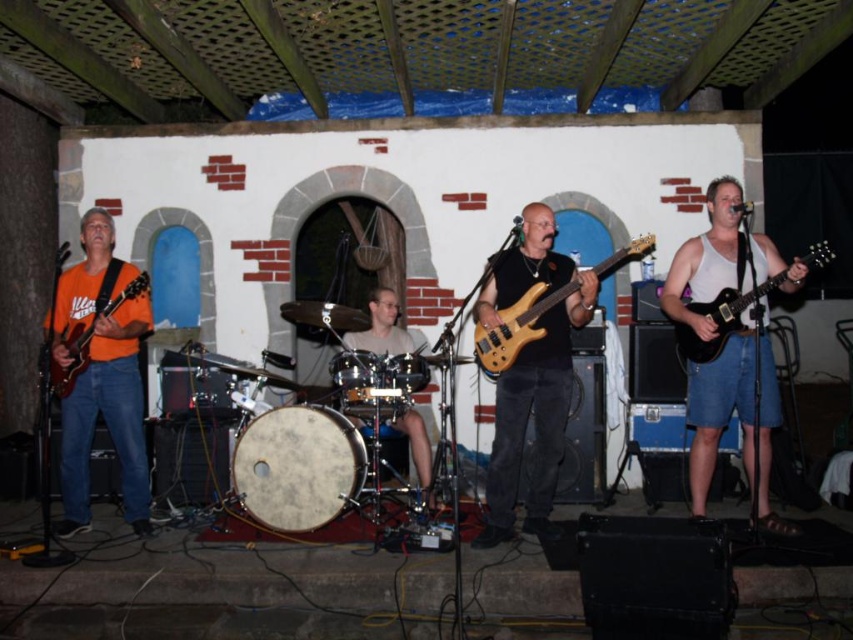
Question: Is black glossy electric guitar at right in front of smooth black drum at center?

Choices:
 (A) no
 (B) yes

Answer: (B)

Question: Does wooden electric bass at center have a smaller size compared to black glossy electric guitar at right?

Choices:
 (A) no
 (B) yes

Answer: (B)

Question: Which of these objects is positioned closest to the smooth white drum at center?

Choices:
 (A) smooth black drum at center
 (B) matte wood bass guitar at center

Answer: (A)

Question: Which of these objects is positioned farthest from the white tank top at right?

Choices:
 (A) gray fabric drum at center
 (B) matte orange guitar at left
 (C) black glossy electric guitar at right

Answer: (B)

Question: Considering the real-world distances, which object is farthest from the smooth white drum at center?

Choices:
 (A) orange matte guitar at left
 (B) black glossy electric guitar at right

Answer: (B)

Question: Observing the image, what is the correct spatial positioning of gray fabric drum at center in reference to smooth black drum at center?

Choices:
 (A) below
 (B) above

Answer: (B)